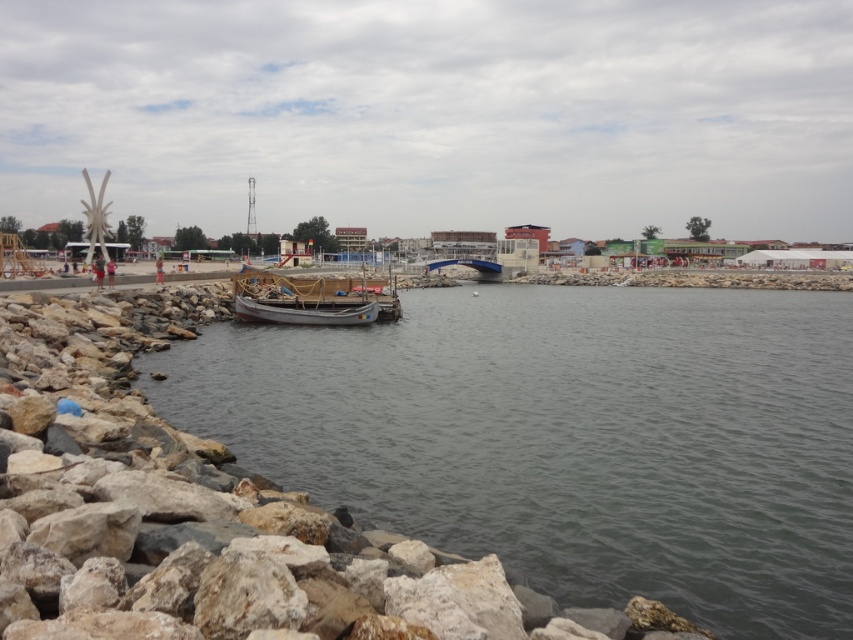
You are a photographer planning to take a photo of the wooden boat at center and the clear water at lower left. Based on their positions, which object appears closer to the camera?

The clear water at lower left appears closer to the camera because it is much taller than the wooden boat at center, indicating it occupies a larger portion of the frame from the viewer perspective.

You are standing at the origin point of the image. Which direction should you move to reach the clear water at lower left?

The clear water at lower left is located at point (567, 438) in 2D coordinates, so you should move towards the lower left direction to reach it.

You are a photographer planning to capture the wooden boat at center and the clear water at lower left in a single shot. Given that your camera can only focus on objects within a 10m width, can you confirm if both objects will fit horizontally in the frame?

The clear water at lower left is bigger than the wooden boat at center. Since the camera can focus on objects within a 10m width, and the larger clear water at lower left might exceed this limit, it is uncertain if both will fit without cropping.